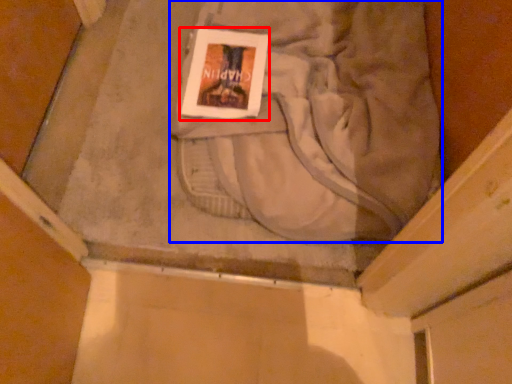
Question: Which point is further to the camera, paperback book (highlighted by a red box) or sweat pant (highlighted by a blue box)?

Choices:
 (A) paperback book
 (B) sweat pant

Answer: (A)